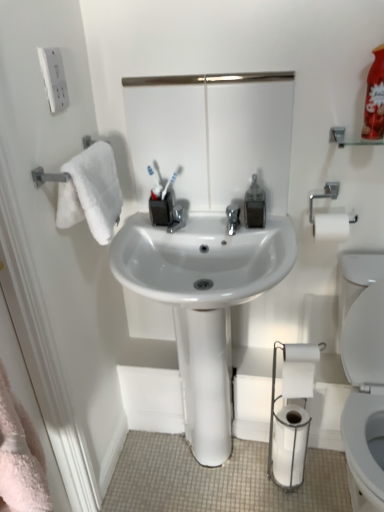
Identify the location of vacant point above white glossy mirror at upper center (from a real-world perspective). (204, 75).